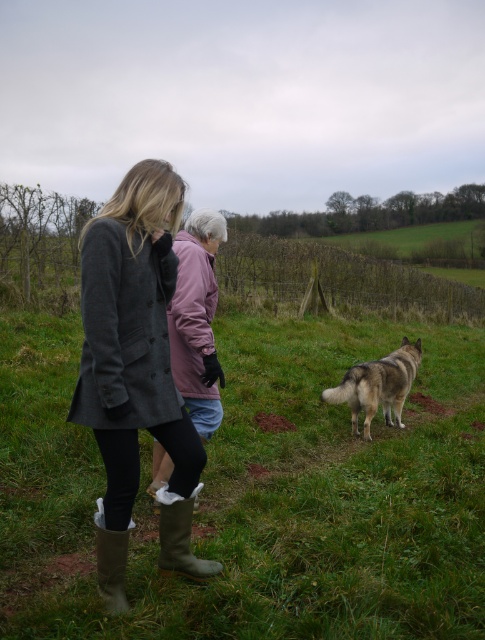
Question: Can you confirm if brown suede boot at lower left is positioned to the left of green rubber boot at lower left?

Choices:
 (A) no
 (B) yes

Answer: (A)

Question: Which of the following is the closest to the observer?

Choices:
 (A) (103, 595)
 (B) (170, 216)
 (C) (394, 353)

Answer: (A)

Question: Which point appears farthest from the camera in this image?

Choices:
 (A) (376, 385)
 (B) (308, 484)

Answer: (A)

Question: Can you confirm if green grassy field at center is positioned to the left of fuzzy gray dog at lower right?

Choices:
 (A) yes
 (B) no

Answer: (A)

Question: Can you confirm if green grassy field at center is positioned below fuzzy gray dog at lower right?

Choices:
 (A) yes
 (B) no

Answer: (B)

Question: Which of the following is the closest to the observer?

Choices:
 (A) fuzzy gray dog at lower right
 (B) dark gray wool coat at center

Answer: (B)